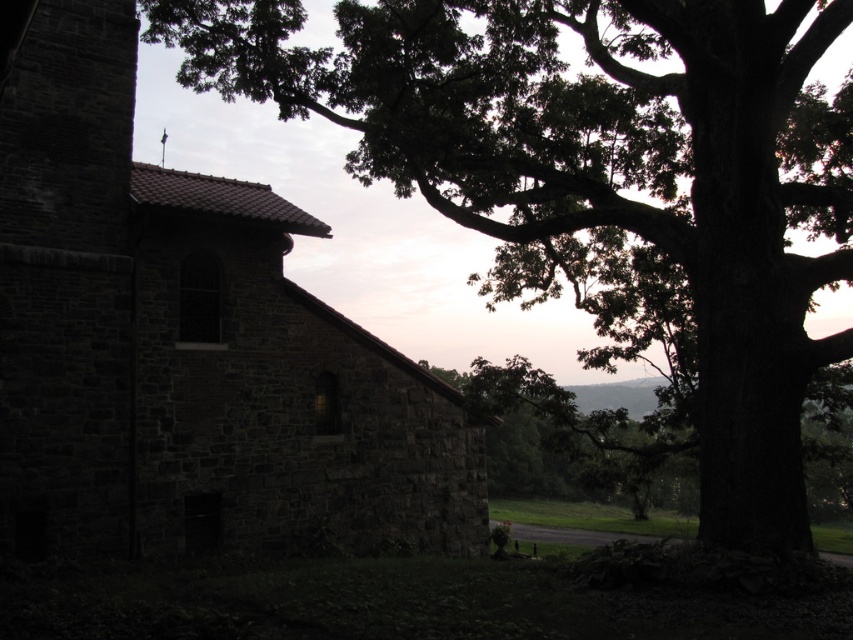
Question: Can you confirm if dark green leafy tree at upper right is wider than dark stone church at left?

Choices:
 (A) yes
 (B) no

Answer: (A)

Question: Considering the relative positions of dark green leafy tree at upper right and dark stone church at left in the image provided, where is dark green leafy tree at upper right located with respect to dark stone church at left?

Choices:
 (A) above
 (B) below

Answer: (A)

Question: Which point is closer to the camera?

Choices:
 (A) dark stone church at left
 (B) dark green leafy tree at upper right

Answer: (A)

Question: Which point is closer to the camera taking this photo?

Choices:
 (A) (288, 520)
 (B) (759, 252)

Answer: (B)

Question: Is dark green leafy tree at upper right behind dark stone church at left?

Choices:
 (A) no
 (B) yes

Answer: (B)